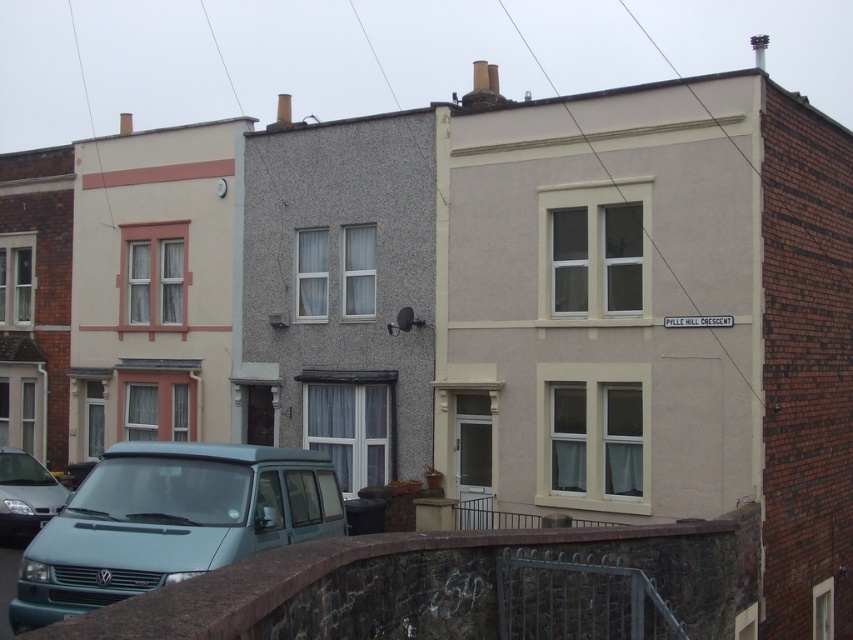
Question: Among these points, which one is farthest from the camera?

Choices:
 (A) (3, 481)
 (B) (54, 596)

Answer: (A)

Question: Is teal matte van at center to the right of matte silver van at lower left from the viewer's perspective?

Choices:
 (A) yes
 (B) no

Answer: (A)

Question: Among these objects, which one is farthest from the camera?

Choices:
 (A) teal matte van at center
 (B) matte silver van at lower left

Answer: (B)

Question: Which point is farther to the camera?

Choices:
 (A) matte silver van at lower left
 (B) teal matte van at center

Answer: (A)

Question: Can you confirm if teal matte van at center is positioned above matte silver van at lower left?

Choices:
 (A) no
 (B) yes

Answer: (B)

Question: Is teal matte van at center below matte silver van at lower left?

Choices:
 (A) yes
 (B) no

Answer: (B)